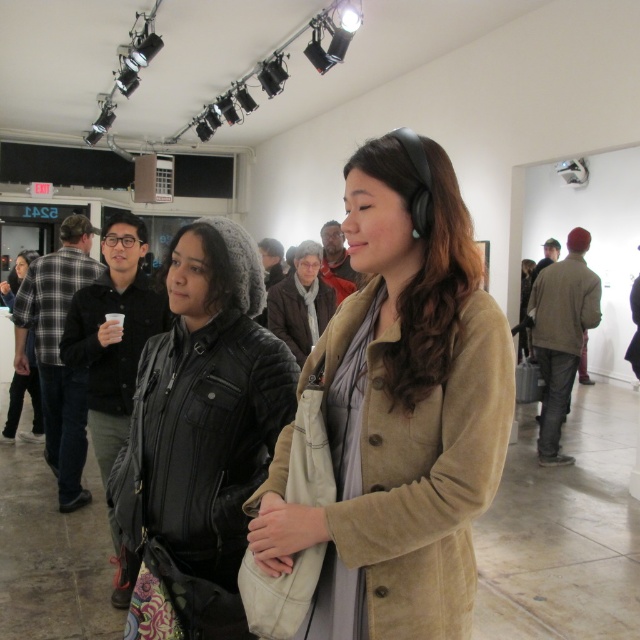
You are an art gallery attendant and need to guide a visitor to the coat check. The visitor is wearing a suede beige coat at center and a black quilted jacket at center. Which one of these is closer to the right side of the gallery?

The suede beige coat at center is to the right of the black quilted jacket at center, so the suede beige coat at center is closer to the right side of the gallery.

You are an art gallery assistant and need to place a small sculpture exactly at the point marked as point (400,410). The sculpture is 10 cm in diameter. The suede beige coat at center is currently being worn by a visitor. Is there enough space to place the sculpture at that point without touching the suede beige coat at center?

The point (400,410) is on the suede beige coat at center, so placing the sculpture there would directly touch the coat. Therefore, there is not enough space to place the sculpture at that point without touching the suede beige coat at center.

You are an art gallery attendant who needs to hang a coat rack exactly between the suede beige coat at center and the black quilted jacket at center. Since the rack must be placed equidistant from both, which coat should the rack be closer to based on their heights?

The coat rack should be placed closer to the suede beige coat at center because it is shorter than the black quilted jacket at center, ensuring equal distance from both.